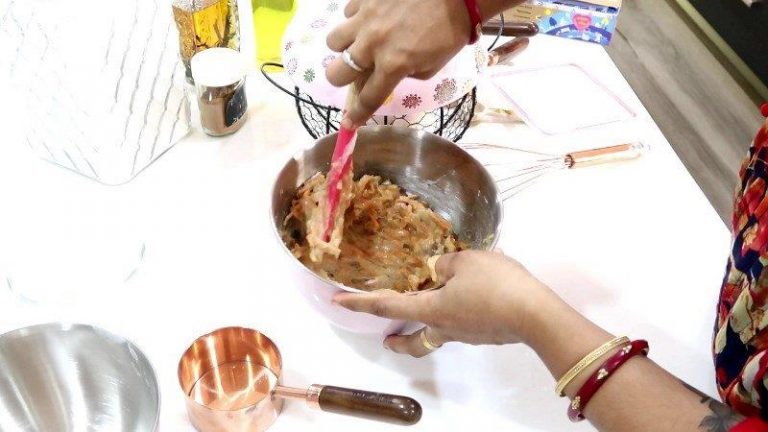
Where is `rug`? The width and height of the screenshot is (768, 432). rug is located at coordinates (736, 28).